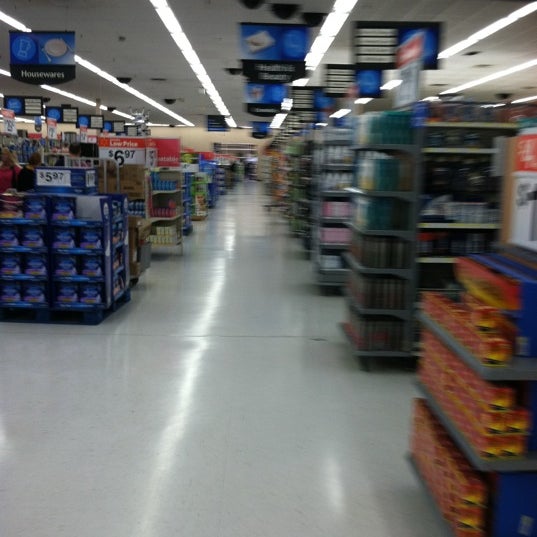
Identify the location of floor. pos(194,430).